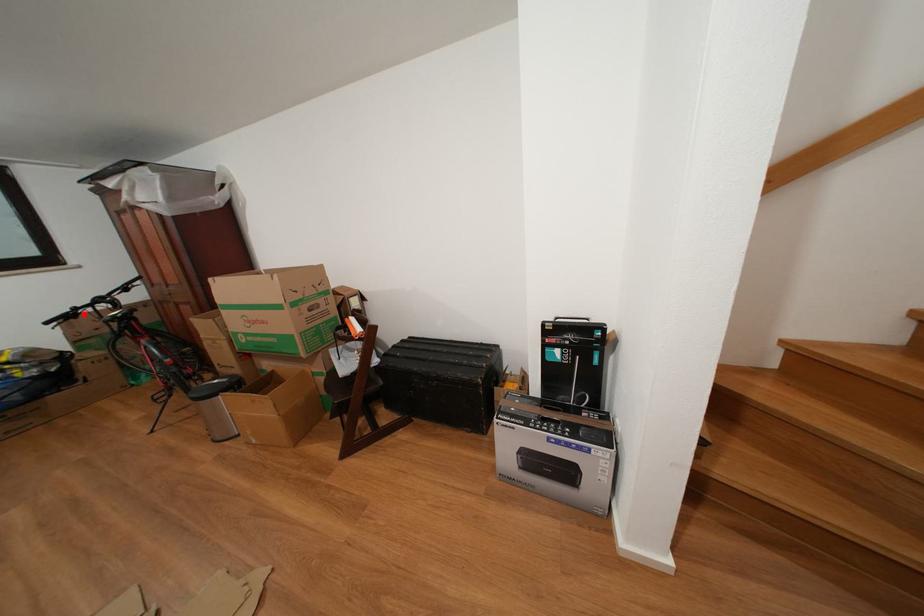
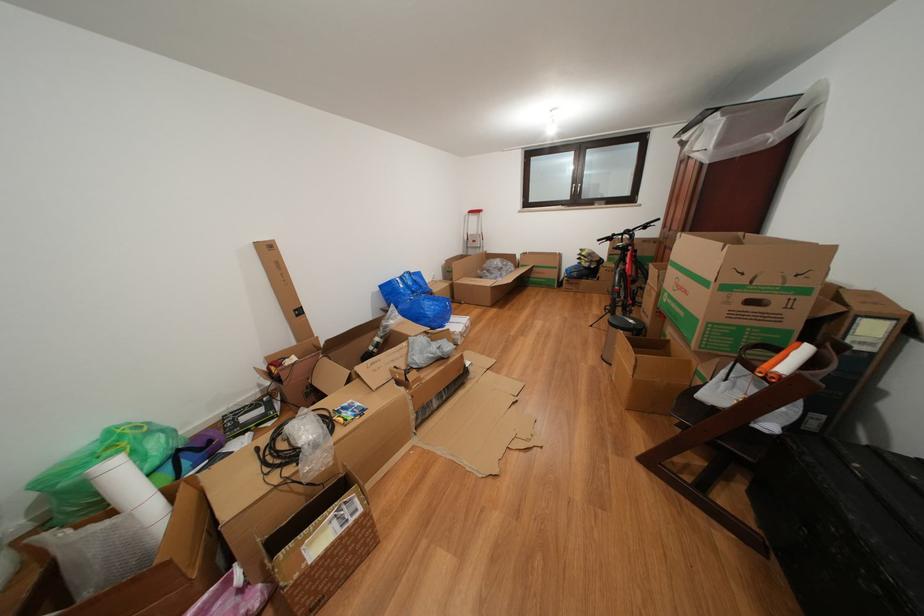
Find the pixel in the second image that matches the highlighted location in the first image.

(622, 240)